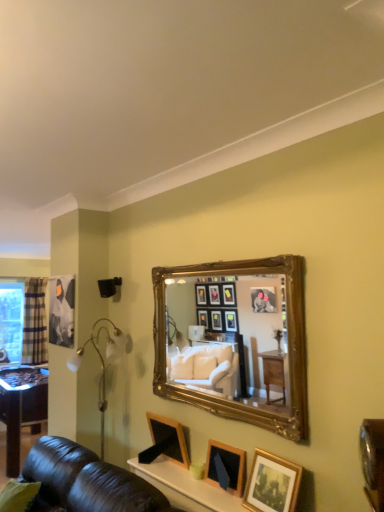
Question: Considering the relative positions of wooden picture frame at lower center, the 3th picture frame from the front, and gold-framed mirror at upper center in the image provided, is wooden picture frame at lower center, the 3th picture frame from the front, to the left of gold-framed mirror at upper center from the viewer's perspective?

Choices:
 (A) yes
 (B) no

Answer: (A)

Question: Considering the relative sizes of wooden picture frame at lower center, the 3th picture frame from the front, and gold-framed mirror at upper center in the image provided, is wooden picture frame at lower center, the 3th picture frame from the front, shorter than gold-framed mirror at upper center?

Choices:
 (A) no
 (B) yes

Answer: (B)

Question: Is the depth of wooden picture frame at lower center, marked as the 3th picture frame in a right-to-left arrangement, greater than that of gold-framed mirror at upper center?

Choices:
 (A) no
 (B) yes

Answer: (B)

Question: Is wooden picture frame at lower center, the first picture frame in the back-to-front sequence, beside gold-framed mirror at upper center?

Choices:
 (A) no
 (B) yes

Answer: (A)

Question: Considering the relative positions of wooden picture frame at lower center, marked as the 3th picture frame in a right-to-left arrangement, and gold-framed mirror at upper center in the image provided, is wooden picture frame at lower center, marked as the 3th picture frame in a right-to-left arrangement, in front of gold-framed mirror at upper center?

Choices:
 (A) no
 (B) yes

Answer: (A)

Question: From a real-world perspective, is wooden picture frame at lower center, arranged as the second picture frame when viewed from the right, physically located above or below gold-framed mirror at upper center?

Choices:
 (A) above
 (B) below

Answer: (B)

Question: Considering the positions of wooden picture frame at lower center, the second picture frame positioned from the left, and gold-framed mirror at upper center in the image, is wooden picture frame at lower center, the second picture frame positioned from the left, taller or shorter than gold-framed mirror at upper center?

Choices:
 (A) tall
 (B) short

Answer: (B)

Question: Which is correct: wooden picture frame at lower center, arranged as the second picture frame when viewed from the right, is inside gold-framed mirror at upper center, or outside of it?

Choices:
 (A) inside
 (B) outside

Answer: (B)

Question: In the image, is wooden picture frame at lower center, which appears as the second picture frame when viewed from the back, on the left side or the right side of gold-framed mirror at upper center?

Choices:
 (A) left
 (B) right

Answer: (B)

Question: From a real-world perspective, relative to clear plastic window screen at left, is wooden picture frame at lower center, which ranks as the 2th picture frame in front-to-back order, vertically above or below?

Choices:
 (A) above
 (B) below

Answer: (B)

Question: Does point (208, 446) appear closer or farther from the camera than point (16, 327)?

Choices:
 (A) closer
 (B) farther

Answer: (A)

Question: From the image's perspective, relative to clear plastic window screen at left, is wooden picture frame at lower center, arranged as the second picture frame when viewed from the right, above or below?

Choices:
 (A) above
 (B) below

Answer: (B)

Question: Considering their positions, is wooden picture frame at lower center, which appears as the second picture frame when viewed from the back, located in front of or behind clear plastic window screen at left?

Choices:
 (A) front
 (B) behind

Answer: (A)

Question: In the image, is gold-framed mirror at upper center positioned in front of or behind wooden picture frame at lower center, arranged as the second picture frame when viewed from the right?

Choices:
 (A) front
 (B) behind

Answer: (A)

Question: Is point pyautogui.click(x=279, y=329) positioned closer to the camera than point pyautogui.click(x=210, y=477)?

Choices:
 (A) closer
 (B) farther

Answer: (A)